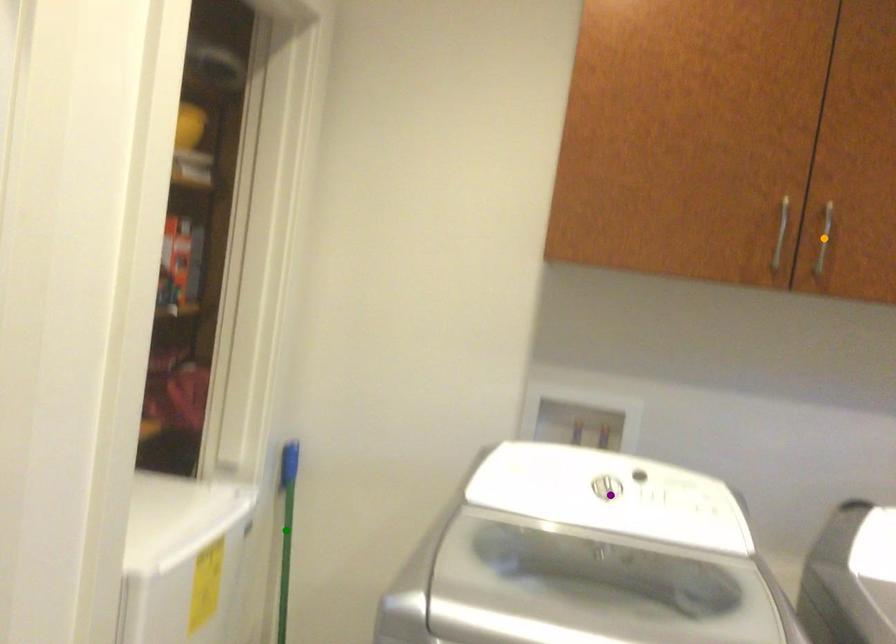
Order these from nearest to farthest:
- green point
- purple point
- orange point

1. orange point
2. purple point
3. green point